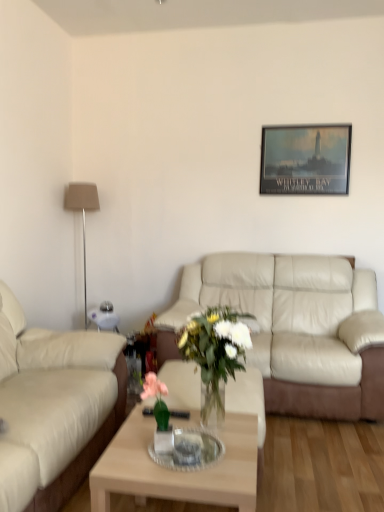
Question: Considering the relative positions of light wood/transparent glass coffee table at center and beige leather couch at center, marked as the 1th studio couch in a right-to-left arrangement, in the image provided, is light wood/transparent glass coffee table at center behind beige leather couch at center, marked as the 1th studio couch in a right-to-left arrangement,?

Choices:
 (A) no
 (B) yes

Answer: (A)

Question: From the image's perspective, is light wood/transparent glass coffee table at center under beige leather couch at center, placed as the second studio couch when sorted from front to back?

Choices:
 (A) yes
 (B) no

Answer: (A)

Question: Is light wood/transparent glass coffee table at center taller than beige leather couch at center, placed as the second studio couch when sorted from front to back?

Choices:
 (A) yes
 (B) no

Answer: (B)

Question: Is light wood/transparent glass coffee table at center directly adjacent to beige leather couch at center, which is counted as the first studio couch, starting from the back?

Choices:
 (A) yes
 (B) no

Answer: (B)

Question: From the image's perspective, would you say light wood/transparent glass coffee table at center is positioned over beige leather couch at center, the second studio couch viewed from the left?

Choices:
 (A) no
 (B) yes

Answer: (A)

Question: Which is correct: white glass vase at center is inside beige leather couch at center, the second studio couch viewed from the left, or outside of it?

Choices:
 (A) outside
 (B) inside

Answer: (A)

Question: Considering the positions of white glass vase at center and beige leather couch at center, placed as the second studio couch when sorted from front to back, in the image, is white glass vase at center wider or thinner than beige leather couch at center, placed as the second studio couch when sorted from front to back,?

Choices:
 (A) thin
 (B) wide

Answer: (A)

Question: In the image, is white glass vase at center positioned in front of or behind beige leather couch at center, the second studio couch viewed from the left?

Choices:
 (A) front
 (B) behind

Answer: (A)

Question: From a real-world perspective, is white glass vase at center above or below beige leather couch at center, marked as the 1th studio couch in a right-to-left arrangement?

Choices:
 (A) below
 (B) above

Answer: (B)

Question: Does point 84,313 appear closer or farther from the camera than point 279,190?

Choices:
 (A) farther
 (B) closer

Answer: (A)

Question: From the image's perspective, is beige fabric lamp at left located above or below matte black poster at upper center?

Choices:
 (A) above
 (B) below

Answer: (B)

Question: Visually, is beige fabric lamp at left positioned to the left or to the right of matte black poster at upper center?

Choices:
 (A) left
 (B) right

Answer: (A)

Question: From a real-world perspective, is beige fabric lamp at left above or below matte black poster at upper center?

Choices:
 (A) below
 (B) above

Answer: (A)

Question: Is point (48, 478) positioned closer to the camera than point (291, 362)?

Choices:
 (A) closer
 (B) farther

Answer: (A)

Question: Is beige leather couch at left, the 1th studio couch from the left, situated inside beige leather couch at center, the second studio couch viewed from the left, or outside?

Choices:
 (A) outside
 (B) inside

Answer: (A)